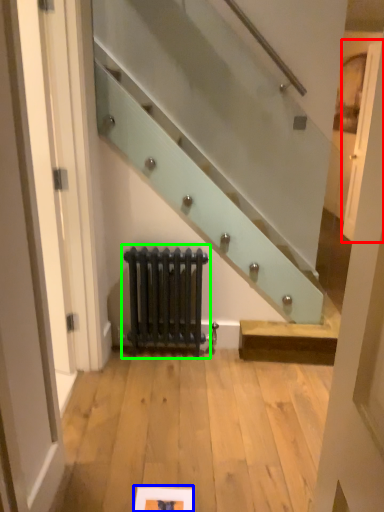
Question: Considering the real-world distances, which object is closest to door (highlighted by a red box)? picture frame (highlighted by a blue box) or radiator (highlighted by a green box).

Choices:
 (A) picture frame
 (B) radiator

Answer: (B)